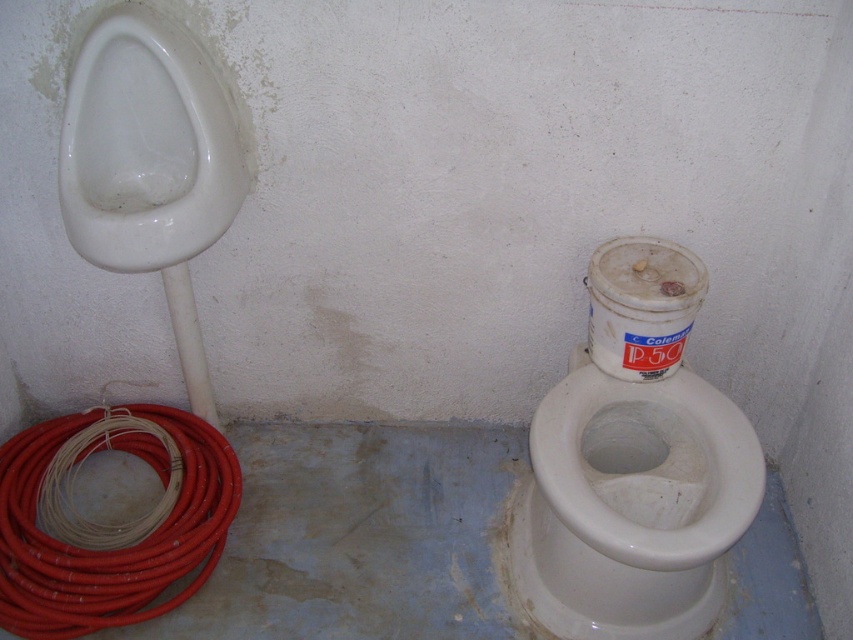
Question: Is white glossy toilet bowl at lower right smaller than red rubber hose at lower left?

Choices:
 (A) yes
 (B) no

Answer: (B)

Question: Considering the real-world distances, which object is closest to the white glossy toilet bowl at lower right?

Choices:
 (A) red rubber hose at lower left
 (B) white glossy urinal at left

Answer: (A)

Question: Which of the following is the closest to the observer?

Choices:
 (A) red rubber hose at lower left
 (B) white glossy urinal at left

Answer: (B)

Question: Is white glossy urinal at left bigger than red rubber hose at lower left?

Choices:
 (A) yes
 (B) no

Answer: (B)

Question: Does white glossy toilet bowl at lower right have a smaller size compared to red rubber hose at lower left?

Choices:
 (A) yes
 (B) no

Answer: (B)

Question: Which point is closer to the camera?

Choices:
 (A) (x=177, y=413)
 (B) (x=622, y=458)
 (C) (x=187, y=74)

Answer: (C)